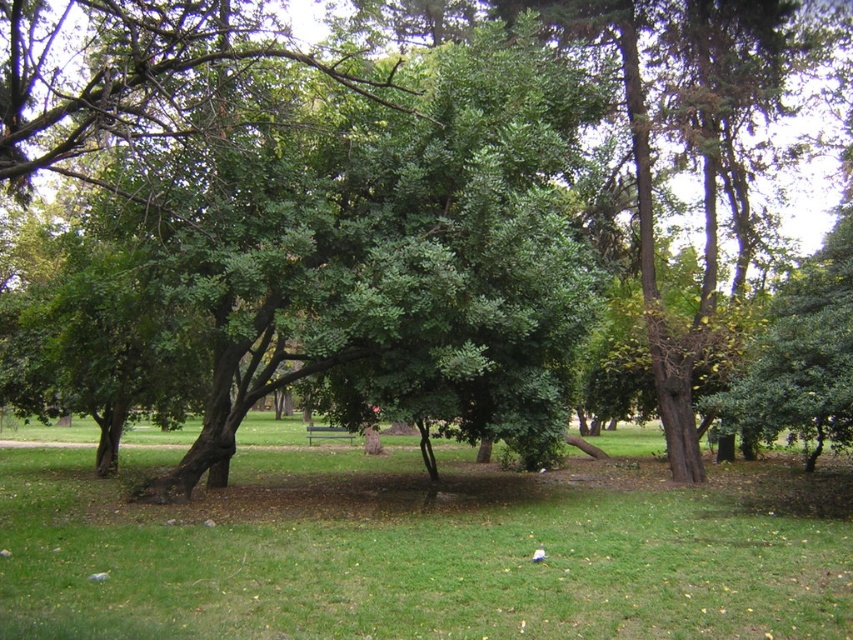
Question: Which point is farther to the camera?

Choices:
 (A) (350, 440)
 (B) (219, 616)

Answer: (A)

Question: Is green grassy at center to the left of metallic silver bench at center from the viewer's perspective?

Choices:
 (A) no
 (B) yes

Answer: (A)

Question: Is green grassy at center wider than metallic silver bench at center?

Choices:
 (A) yes
 (B) no

Answer: (A)

Question: Is green grassy at center below metallic silver bench at center?

Choices:
 (A) no
 (B) yes

Answer: (A)

Question: Which point is farther to the camera?

Choices:
 (A) (345, 436)
 (B) (473, 568)

Answer: (A)